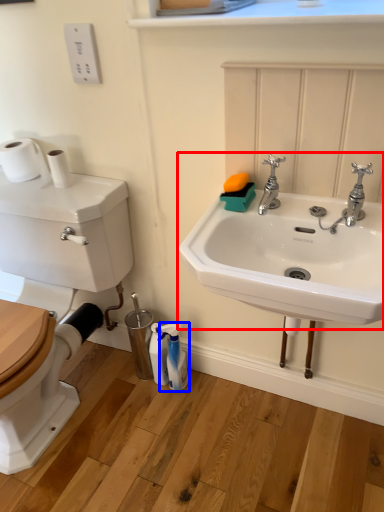
Question: Which object appears closest to the camera in this image, sink (highlighted by a red box) or cleaning product (highlighted by a blue box)?

Choices:
 (A) sink
 (B) cleaning product

Answer: (A)